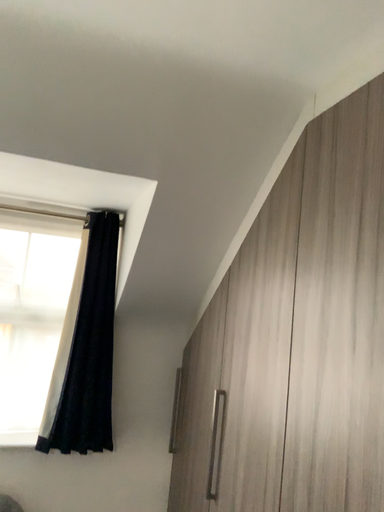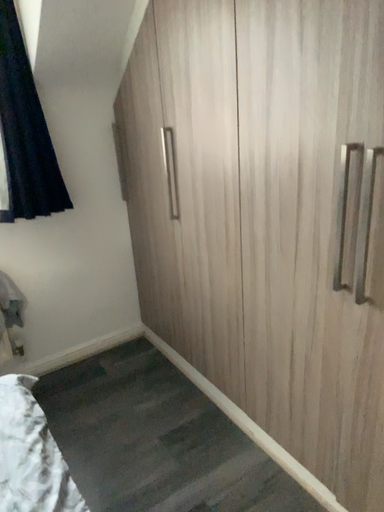
Question: Which way did the camera rotate in the video?

Choices:
 (A) rotated upward
 (B) rotated downward

Answer: (B)